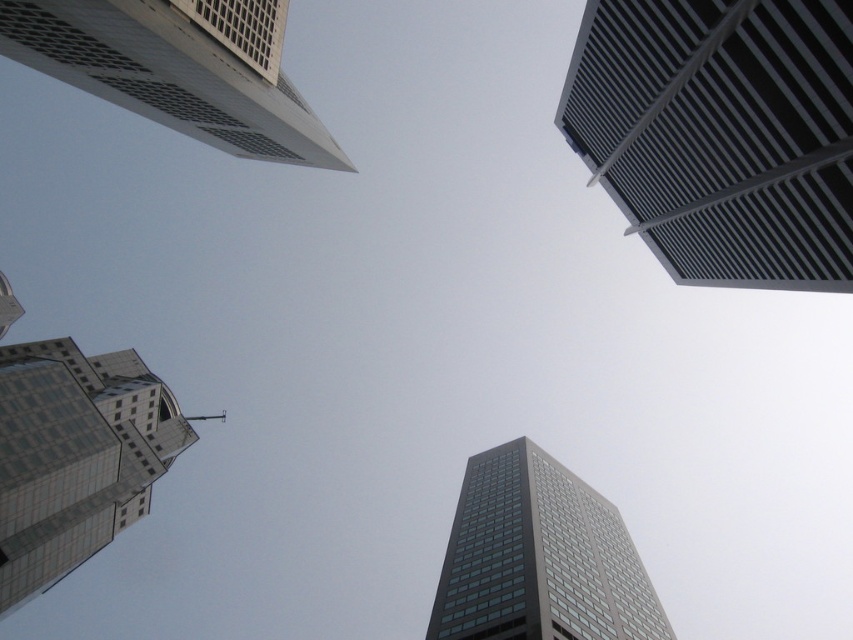
You are an architect analyzing the structural integrity of the buildings in the image. Given that the metallic gray building at upper right might be wider than the matte glass tower at lower left, which building should you prioritize for a load distribution assessment?

The metallic gray building at upper right should be prioritized for a load distribution assessment since it might be wider than the matte glass tower at lower left, requiring more thorough analysis of its structural support system.

You are a drone operator who needs to fly a drone between the matte glass tower at lower left and the dark gray glass skyscraper at center. The drone has a maximum flight distance of 50 meters. Can the drone safely fly between them without exceeding its range?

The matte glass tower at lower left and dark gray glass skyscraper at center are 49.50 meters apart, so the drone can safely fly between them as the distance is within its 50 meters range.